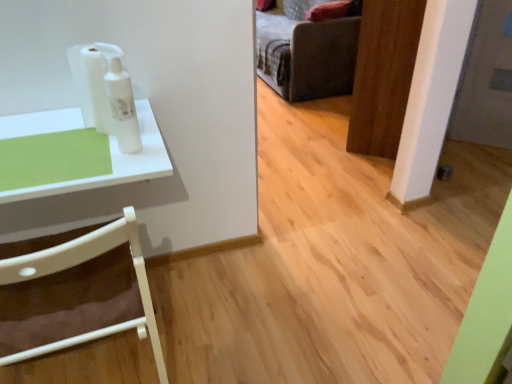
Question: Is the position of dark gray fabric couch at upper center more distant than that of white glossy lotion at upper left?

Choices:
 (A) no
 (B) yes

Answer: (B)

Question: Considering the relative sizes of dark gray fabric couch at upper center and white glossy lotion at upper left in the image provided, is dark gray fabric couch at upper center shorter than white glossy lotion at upper left?

Choices:
 (A) yes
 (B) no

Answer: (B)

Question: Can you confirm if dark gray fabric couch at upper center is bigger than white glossy lotion at upper left?

Choices:
 (A) no
 (B) yes

Answer: (B)

Question: Would you say white glossy lotion at upper left is part of dark gray fabric couch at upper center's contents?

Choices:
 (A) no
 (B) yes

Answer: (A)

Question: Is dark gray fabric couch at upper center taller than white glossy lotion at upper left?

Choices:
 (A) no
 (B) yes

Answer: (B)

Question: Is point (49, 269) positioned closer to the camera than point (113, 127)?

Choices:
 (A) farther
 (B) closer

Answer: (B)

Question: From the image's perspective, relative to white glossy lotion at upper left, is white plastic chair at left above or below?

Choices:
 (A) below
 (B) above

Answer: (A)

Question: Is white plastic chair at left in front of or behind white glossy lotion at upper left in the image?

Choices:
 (A) front
 (B) behind

Answer: (A)

Question: Considering the relative positions of white plastic chair at left and white glossy lotion at upper left in the image provided, is white plastic chair at left to the left or to the right of white glossy lotion at upper left?

Choices:
 (A) right
 (B) left

Answer: (B)

Question: Considering the positions of dark gray fabric couch at upper center and white glossy lotion at upper left in the image, is dark gray fabric couch at upper center bigger or smaller than white glossy lotion at upper left?

Choices:
 (A) small
 (B) big

Answer: (B)

Question: Relative to white glossy lotion at upper left, is dark gray fabric couch at upper center in front or behind?

Choices:
 (A) front
 (B) behind

Answer: (B)

Question: Is dark gray fabric couch at upper center spatially inside white glossy lotion at upper left, or outside of it?

Choices:
 (A) outside
 (B) inside

Answer: (A)

Question: Considering the positions of dark gray fabric couch at upper center and white glossy lotion at upper left in the image, is dark gray fabric couch at upper center taller or shorter than white glossy lotion at upper left?

Choices:
 (A) tall
 (B) short

Answer: (A)

Question: From the image's perspective, is dark gray fabric couch at upper center positioned above or below white plastic chair at left?

Choices:
 (A) below
 (B) above

Answer: (B)

Question: Relative to white plastic chair at left, is dark gray fabric couch at upper center in front or behind?

Choices:
 (A) front
 (B) behind

Answer: (B)